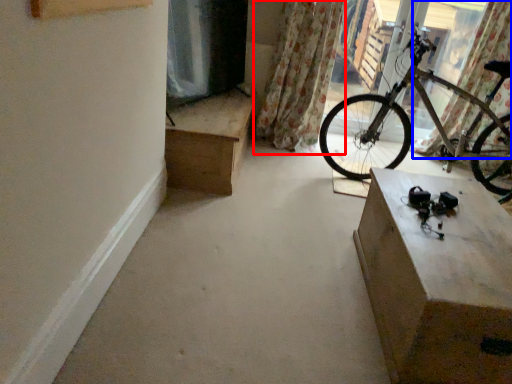
Question: Which object appears farthest to the camera in this image, curtain (highlighted by a red box) or curtain (highlighted by a blue box)?

Choices:
 (A) curtain
 (B) curtain

Answer: (A)